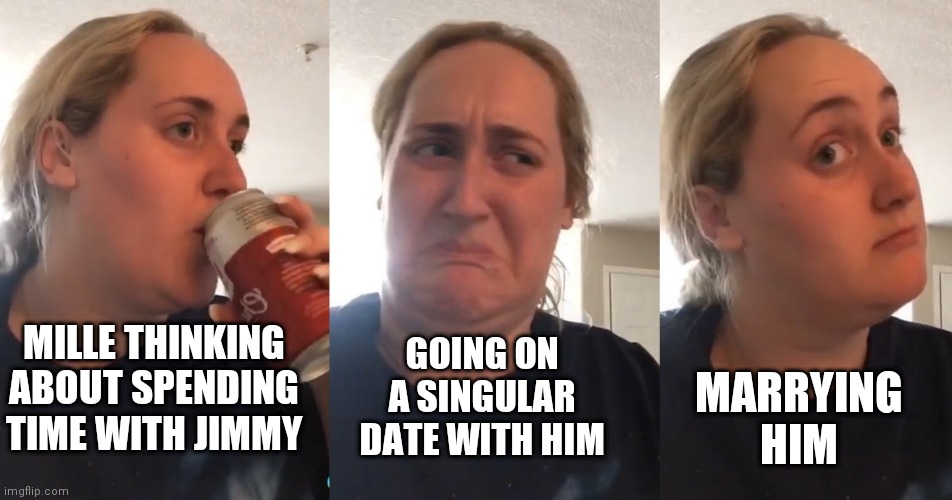
At what (x,y) coordinates should I click in order to perform the action: click on fire extinguisher. Please return your answer as a coordinate pair (x, y). This screenshot has width=952, height=500. Looking at the image, I should click on (307, 48).